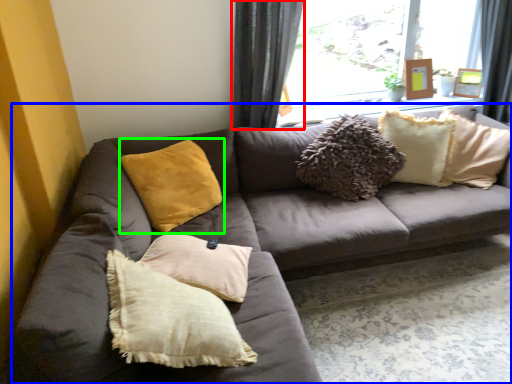
Question: Which object is positioned farthest from curtain (highlighted by a red box)? Select from studio couch (highlighted by a blue box) and pillow (highlighted by a green box).

Choices:
 (A) studio couch
 (B) pillow

Answer: (A)